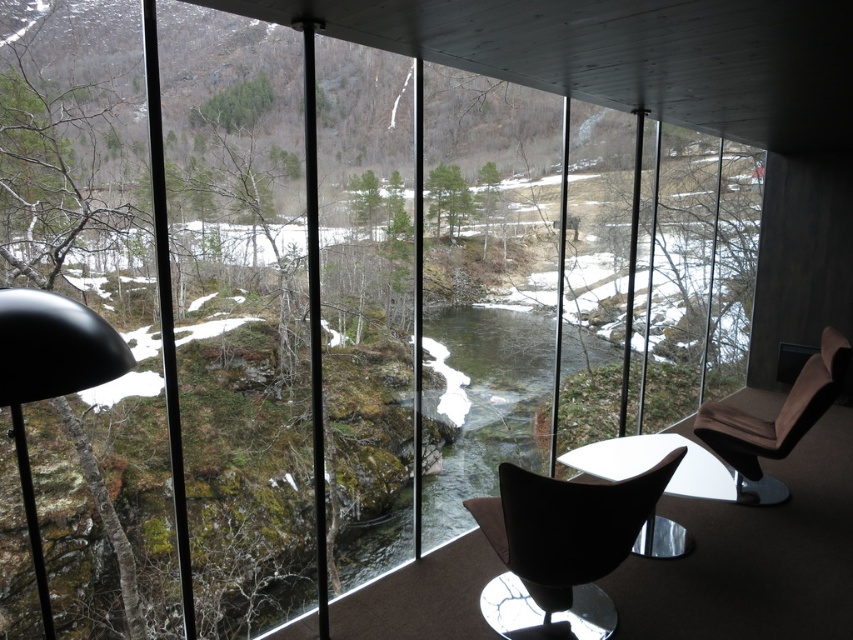
In the scene shown: Can you confirm if matte black swivel chair at center is wider than matte black lamp at left?

Yes.

Can you confirm if matte black swivel chair at center is positioned below matte black lamp at left?

Indeed, matte black swivel chair at center is positioned under matte black lamp at left.

Is point (503, 468) positioned after point (122, 346)?

Yes.

Where is `matte black swivel chair at center`? This screenshot has width=853, height=640. matte black swivel chair at center is located at coordinates (561, 547).

Is point (509, 588) closer to camera compared to point (782, 417)?

Yes, point (509, 588) is closer to viewer.

You are a GUI agent. You are given a task and a screenshot of the screen. Output one action in this format:
    pyautogui.click(x=<x>, y=<y>)
    Task: Click on the matte black swivel chair at center
    
    Given the screenshot: What is the action you would take?
    pyautogui.click(x=561, y=547)

At what (x,y) coordinates should I click in order to perform the action: click on matte black swivel chair at center. Please return your answer as a coordinate pair (x, y). The width and height of the screenshot is (853, 640). Looking at the image, I should click on (561, 547).

Can you confirm if matte black lamp at left is positioned below velvet brown armchair at right?

No.

What do you see at coordinates (49, 378) in the screenshot?
I see `matte black lamp at left` at bounding box center [49, 378].

Between point (76, 365) and point (759, 449), which one is positioned behind?

Point (759, 449)

Identify the location of matte black lamp at left. (49, 378).